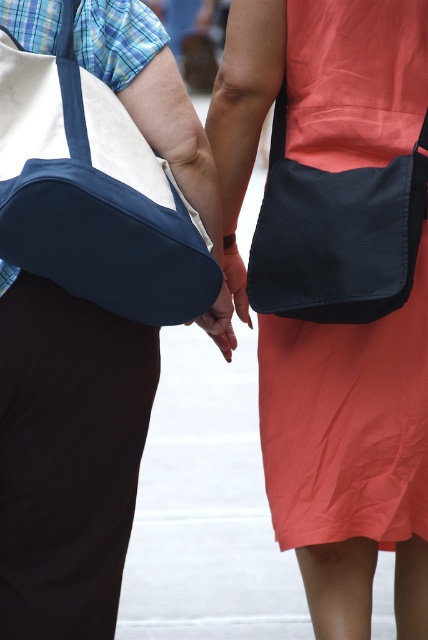
Is matte black apron at center closer to camera compared to matte black hand at center?

No, matte black apron at center is further to the viewer.

Is point (344, 420) in front of point (235, 248)?

Yes, point (344, 420) is closer to viewer.

Is point (382, 321) in front of point (246, 273)?

Yes, it is.

At what (x,y) coordinates should I click in order to perform the action: click on matte black apron at center. Please return your answer as a coordinate pair (x, y). Image resolution: width=428 pixels, height=640 pixels. Looking at the image, I should click on (345, 422).

Is matte black apron at center wider than blue canvas messenger bag at left?

Incorrect, matte black apron at center's width does not surpass blue canvas messenger bag at left's.

Which of these two, matte black apron at center or blue canvas messenger bag at left, stands shorter?

With less height is blue canvas messenger bag at left.

Between point (392, 541) and point (148, 212), which one is positioned in front?

Point (148, 212) is more forward.

Find the location of a particular element. This screenshot has width=428, height=640. matte black apron at center is located at coordinates (345, 422).

Does blue canvas messenger bag at left appear on the left side of matte black hand at center?

Yes, blue canvas messenger bag at left is to the left of matte black hand at center.

Is point (165, 257) positioned before point (244, 301)?

Yes.

Which is in front, point (29, 166) or point (225, 269)?

Point (29, 166) is in front.

Find the location of a particular element. Image resolution: width=428 pixels, height=640 pixels. blue canvas messenger bag at left is located at coordinates (92, 193).